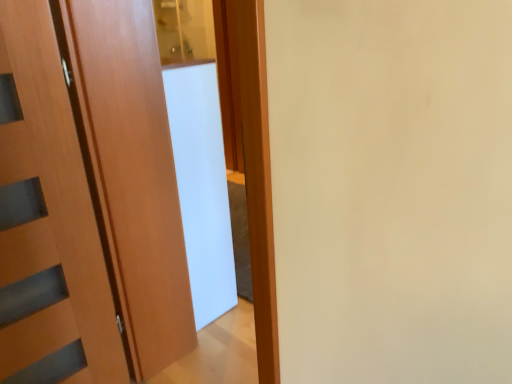
Question: Is white glossy screen door at center surrounding wooden door at left?

Choices:
 (A) yes
 (B) no

Answer: (B)

Question: From the image's perspective, is white glossy screen door at center beneath wooden door at left?

Choices:
 (A) no
 (B) yes

Answer: (A)

Question: Is white glossy screen door at center to the left of wooden door at left from the viewer's perspective?

Choices:
 (A) yes
 (B) no

Answer: (B)

Question: Does white glossy screen door at center lie in front of wooden door at left?

Choices:
 (A) yes
 (B) no

Answer: (B)

Question: Would you consider white glossy screen door at center to be distant from wooden door at left?

Choices:
 (A) no
 (B) yes

Answer: (A)

Question: Is white glossy screen door at center aimed at wooden door at left?

Choices:
 (A) yes
 (B) no

Answer: (B)

Question: Is wooden door at left shorter than white glossy screen door at center?

Choices:
 (A) no
 (B) yes

Answer: (A)

Question: From a real-world perspective, is wooden door at left physically above white glossy screen door at center?

Choices:
 (A) yes
 (B) no

Answer: (A)

Question: Are wooden door at left and white glossy screen door at center far apart?

Choices:
 (A) no
 (B) yes

Answer: (A)

Question: Is wooden door at left to the right of white glossy screen door at center from the viewer's perspective?

Choices:
 (A) no
 (B) yes

Answer: (A)

Question: Is white glossy screen door at center at the back of wooden door at left?

Choices:
 (A) yes
 (B) no

Answer: (B)

Question: Does wooden door at left lie in front of white glossy screen door at center?

Choices:
 (A) yes
 (B) no

Answer: (A)

Question: Is white glossy screen door at center taller or shorter than wooden door at left?

Choices:
 (A) short
 (B) tall

Answer: (A)